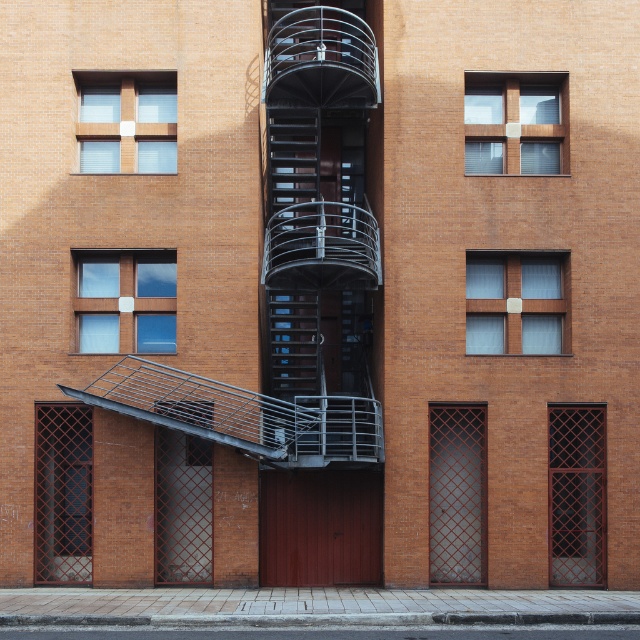
Who is shorter, dark brown lattice door at right or matte glass window at center?

Standing shorter between the two is matte glass window at center.

Where is `dark brown lattice door at right`? dark brown lattice door at right is located at coordinates (577, 496).

Does metallic gray fire escape at center have a greater height compared to metallic lattice door at center-right?

No, metallic gray fire escape at center is not taller than metallic lattice door at center-right.

What do you see at coordinates (320, 236) in the screenshot? The width and height of the screenshot is (640, 640). I see `metallic gray fire escape at center` at bounding box center [320, 236].

Is point (372, 227) positioned in front of point (445, 420)?

That is False.

Find the location of a particular element. metallic gray fire escape at center is located at coordinates (320, 236).

Between point (518, 125) and point (147, 284), which one is positioned in front?

Point (147, 284) is more forward.

How distant is wooden frame at upper center from clear glass window at lower left?

wooden frame at upper center is 4.76 meters from clear glass window at lower left.

Is point (554, 76) behind point (99, 260)?

Yes, point (554, 76) is farther from viewer.

Identify the location of wooden frame at upper center. (516, 122).